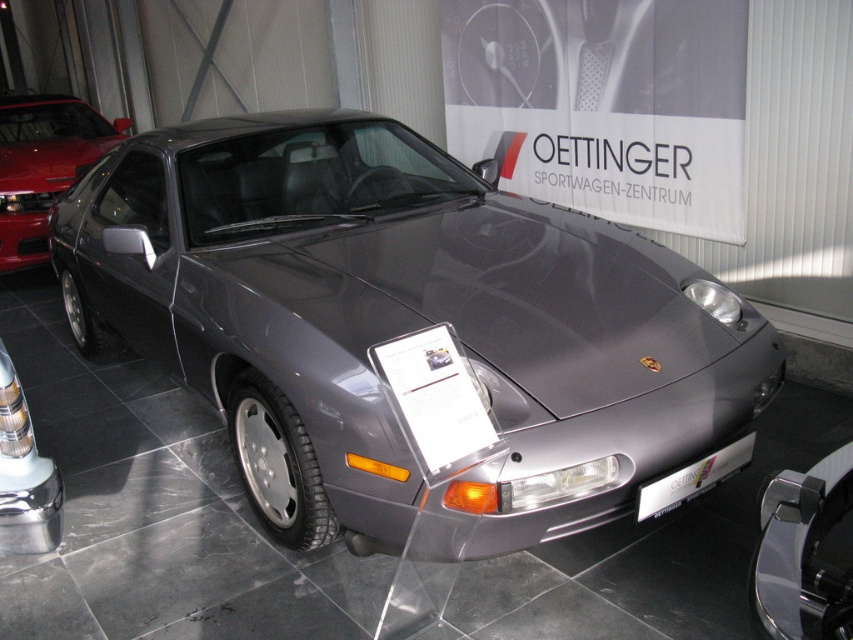
Is satin metallic car at center positioned at the back of satin silver metallic car at center?

That is False.

Can you confirm if satin metallic car at center is positioned to the right of satin silver metallic car at center?

Yes, satin metallic car at center is to the right of satin silver metallic car at center.

Locate an element on the screen. satin metallic car at center is located at coordinates (401, 324).

Measure the distance between satin silver metallic car at center and silver metallic license plate at front.

The distance of satin silver metallic car at center from silver metallic license plate at front is 20.34 feet.

Which of these two, satin silver metallic car at center or silver metallic license plate at front, stands shorter?

silver metallic license plate at front is shorter.

What do you see at coordinates (44, 164) in the screenshot?
I see `satin silver metallic car at center` at bounding box center [44, 164].

At what (x,y) coordinates should I click in order to perform the action: click on satin silver metallic car at center. Please return your answer as a coordinate pair (x, y). Image resolution: width=853 pixels, height=640 pixels. Looking at the image, I should click on (44, 164).

Is satin metallic car at center further to the viewer compared to silver metallic license plate at front?

No, it is in front of silver metallic license plate at front.

Between point (355, 173) and point (697, 488), which one is positioned in front?

Point (697, 488)

Identify the location of satin metallic car at center. (401, 324).